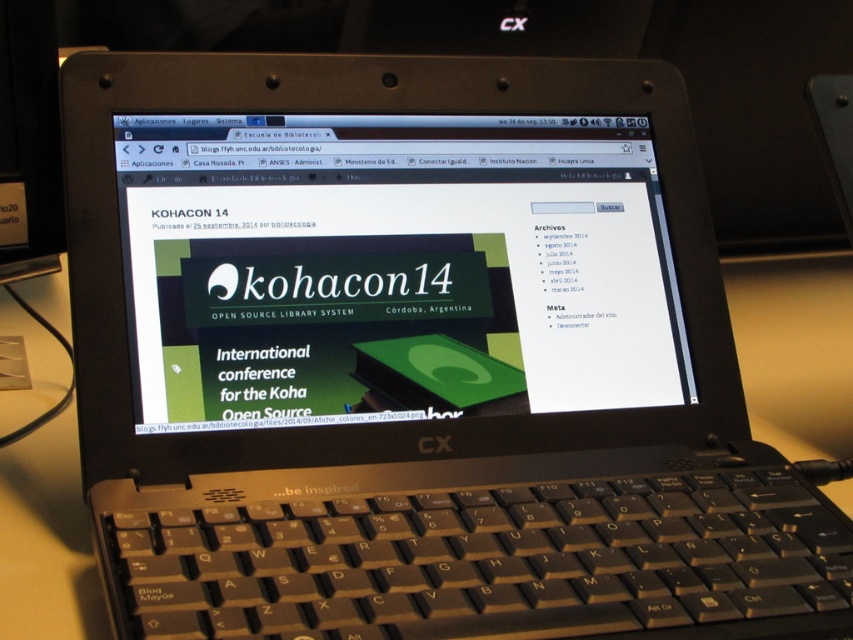
Is green matte book at center further to camera compared to black plastic keyboard at lower center?

Yes, it is.

Who is higher up, green matte book at center or black plastic keyboard at lower center?

green matte book at center is above.

Where is `green matte book at center`? The height and width of the screenshot is (640, 853). green matte book at center is located at coordinates (393, 268).

Locate an element on the screen. This screenshot has width=853, height=640. green matte book at center is located at coordinates (393, 268).